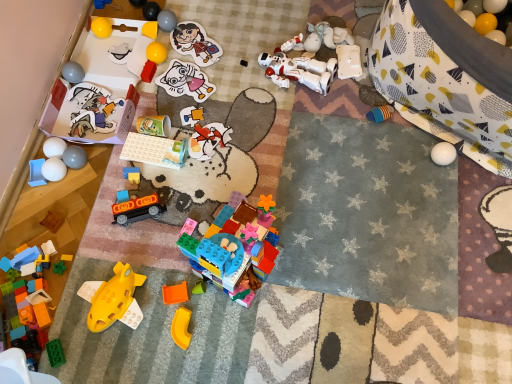
Image resolution: width=512 pixels, height=384 pixels. In order to click on empty space that is to the right of orange matte train at center, placed as the 14th toy when sorted from left to right in this screenshot , I will do `click(189, 206)`.